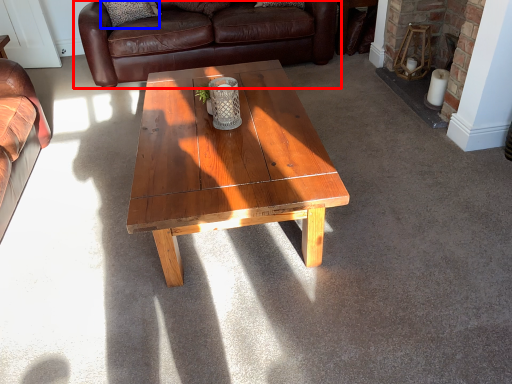
Question: Which point is closer to the camera, studio couch (highlighted by a red box) or pillow (highlighted by a blue box)?

Choices:
 (A) studio couch
 (B) pillow

Answer: (A)